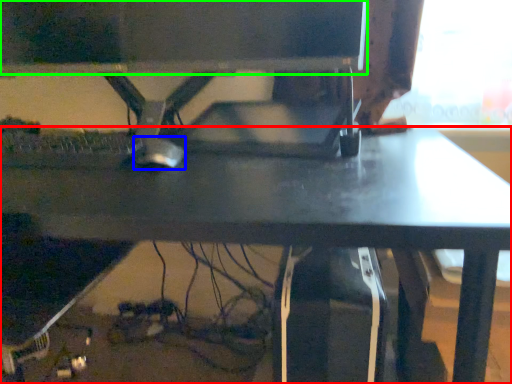
Question: Which object is the closest to the desk (highlighted by a red box)? Choose among these: mouse (highlighted by a blue box) or computer monitor (highlighted by a green box).

Choices:
 (A) mouse
 (B) computer monitor

Answer: (A)